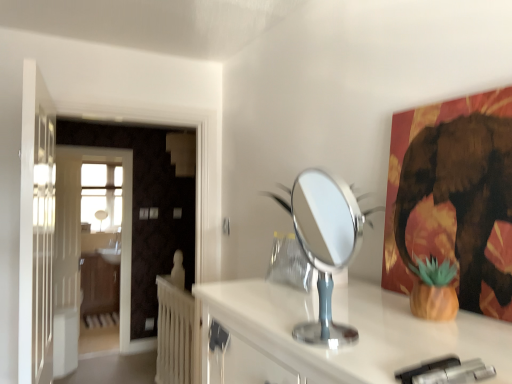
Question: Should I look upward or downward to see white glossy sink at center?

Choices:
 (A) down
 (B) up

Answer: (A)

Question: Is white wooden door at left, which ranks as the second door in right-to-left order, aimed at metallic gold elephant at upper right?

Choices:
 (A) yes
 (B) no

Answer: (B)

Question: From the image's perspective, is white wooden door at left, which is the 2th door in front-to-back order, on top of metallic gold elephant at upper right?

Choices:
 (A) yes
 (B) no

Answer: (B)

Question: Does white wooden door at left, the 1th door when ordered from back to front, have a greater height compared to metallic gold elephant at upper right?

Choices:
 (A) no
 (B) yes

Answer: (B)

Question: Can you confirm if white wooden door at left, which ranks as the second door in right-to-left order, is wider than metallic gold elephant at upper right?

Choices:
 (A) yes
 (B) no

Answer: (B)

Question: Does white wooden door at left, which is the 2th door in front-to-back order, have a larger size compared to metallic gold elephant at upper right?

Choices:
 (A) no
 (B) yes

Answer: (B)

Question: Is white wooden door at left, the 1th door when ordered from back to front, closer to camera compared to metallic gold elephant at upper right?

Choices:
 (A) yes
 (B) no

Answer: (B)

Question: Is white wooden door at left, which is the 1th door from right to left, positioned behind silver metallic mirror at center?

Choices:
 (A) yes
 (B) no

Answer: (A)

Question: Does white wooden door at left, which ranks as the second door in left-to-right order, turn towards silver metallic mirror at center?

Choices:
 (A) yes
 (B) no

Answer: (A)

Question: From the image's perspective, would you say white wooden door at left, which is the 1th door from right to left, is shown under silver metallic mirror at center?

Choices:
 (A) yes
 (B) no

Answer: (A)

Question: Can you confirm if white wooden door at left, which is the 1th door from right to left, is positioned to the left of silver metallic mirror at center?

Choices:
 (A) no
 (B) yes

Answer: (B)

Question: Is silver metallic mirror at center surrounded by white wooden door at left, which is the second door from back to front?

Choices:
 (A) no
 (B) yes

Answer: (A)

Question: From a real-world perspective, does white wooden door at left, which is the second door from back to front, sit lower than silver metallic mirror at center?

Choices:
 (A) yes
 (B) no

Answer: (A)

Question: Considering the relative positions of white glossy sink at center and silver metallic mirror at center in the image provided, is white glossy sink at center to the right of silver metallic mirror at center from the viewer's perspective?

Choices:
 (A) no
 (B) yes

Answer: (A)